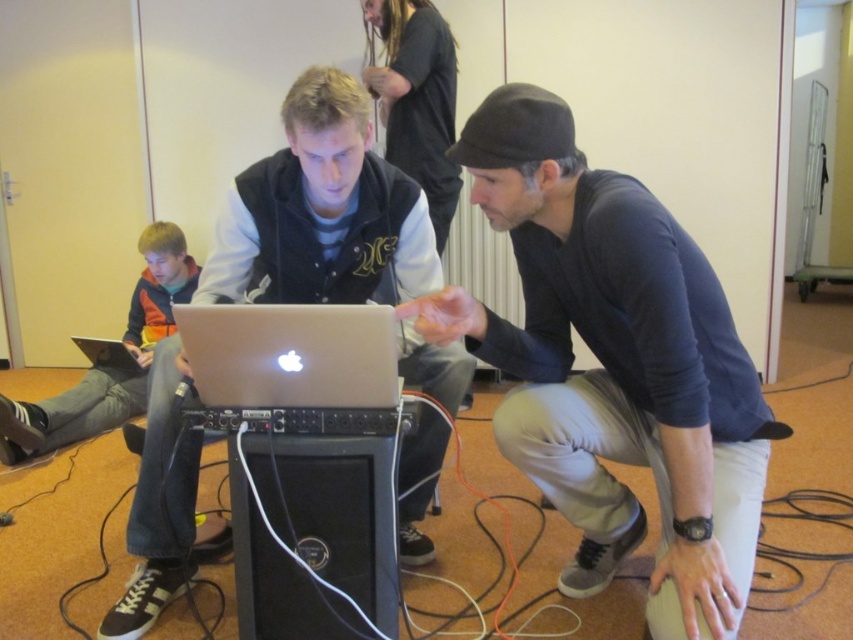
Is point (231, 388) more distant than point (142, 356)?

That is False.

Is point (368, 352) positioned before point (109, 339)?

Yes, it is.

This screenshot has width=853, height=640. What do you see at coordinates (289, 355) in the screenshot?
I see `silver metallic laptop at center` at bounding box center [289, 355].

In order to click on silver metallic laptop at center in this screenshot , I will do point(289,355).

Who is higher up, dark gray knit cap at center or silver metallic laptop at center?

Positioned higher is silver metallic laptop at center.

Which is more to the left, dark gray knit cap at center or silver metallic laptop at center?

Positioned to the left is silver metallic laptop at center.

At what (x,y) coordinates should I click in order to perform the action: click on dark gray knit cap at center. Please return your answer as a coordinate pair (x, y). This screenshot has width=853, height=640. Looking at the image, I should click on (614, 365).

The height and width of the screenshot is (640, 853). Identify the location of dark gray knit cap at center. (614, 365).

Is dark gray knit cap at center to the left of orange fleece jacket at left from the viewer's perspective?

Incorrect, dark gray knit cap at center is not on the left side of orange fleece jacket at left.

Describe the element at coordinates (614, 365) in the screenshot. I see `dark gray knit cap at center` at that location.

I want to click on dark gray knit cap at center, so click(614, 365).